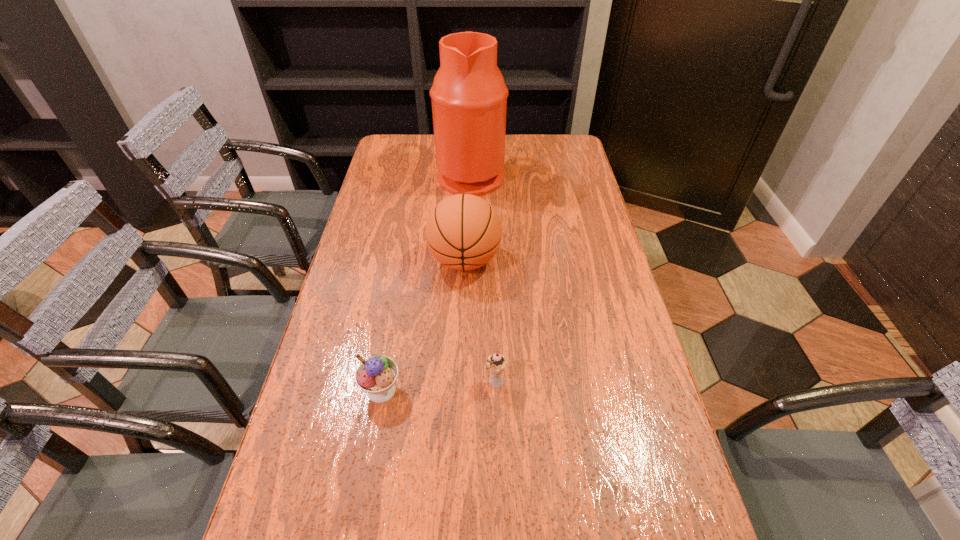
Locate an element on the screen. free point between the leftmost object and the basketball is located at coordinates (423, 325).

This screenshot has width=960, height=540. In order to click on free area in between the farthest object and the right icecream in this screenshot , I will do `click(484, 279)`.

Locate an element on the screen. vacant area that lies between the farthest object and the left icecream is located at coordinates (426, 282).

Locate which object is the second closest to the left icecream. Please provide its 2D coordinates. Your answer should be formatted as a tuple, i.e. [(x, y)], where the tuple contains the x and y coordinates of a point satisfying the conditions above.

[(463, 232)]

Choose which object is the third nearest neighbor to the right icecream. Please provide its 2D coordinates. Your answer should be formatted as a tuple, i.e. [(x, y)], where the tuple contains the x and y coordinates of a point satisfying the conditions above.

[(469, 96)]

Image resolution: width=960 pixels, height=540 pixels. What are the coordinates of `vacant position in the image that satisfies the following two spatial constraints: 1. from the spout of the water jug; 2. on the right side of the right icecream` in the screenshot? It's located at (465, 383).

I want to click on free space that satisfies the following two spatial constraints: 1. from the spout of the farthest object; 2. on the back side of the right icecream, so click(465, 383).

Where is `vacant space that satisfies the following two spatial constraints: 1. from the spout of the water jug; 2. on the left side of the right icecream`? vacant space that satisfies the following two spatial constraints: 1. from the spout of the water jug; 2. on the left side of the right icecream is located at coordinates (465, 383).

At what (x,y) coordinates should I click in order to perform the action: click on vacant position in the image that satisfies the following two spatial constraints: 1. from the spout of the tallest object; 2. on the left side of the right icecream. Please return your answer as a coordinate pair (x, y). This screenshot has height=540, width=960. Looking at the image, I should click on (465, 383).

This screenshot has height=540, width=960. I want to click on vacant point that satisfies the following two spatial constraints: 1. from the spout of the farthest object; 2. on the back side of the right icecream, so click(x=465, y=383).